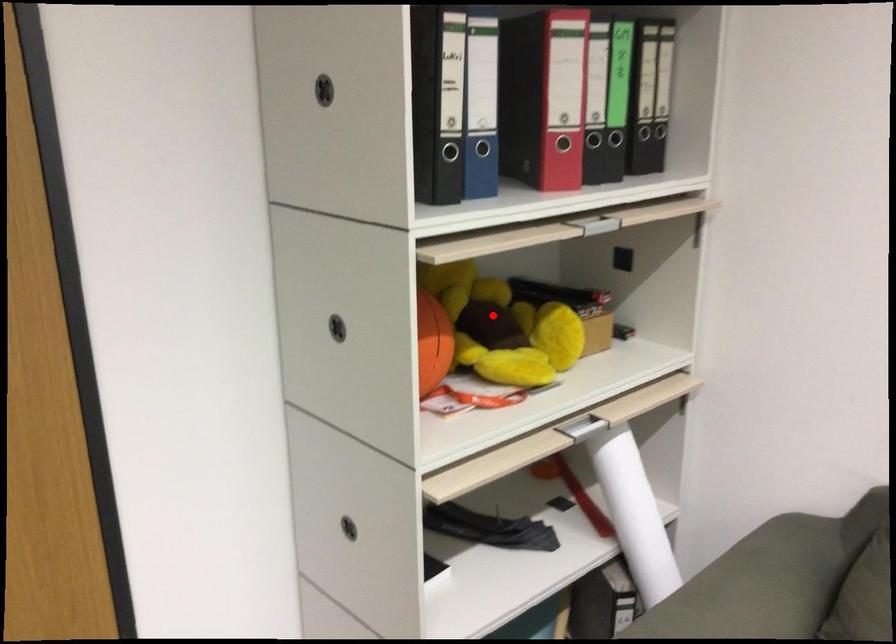
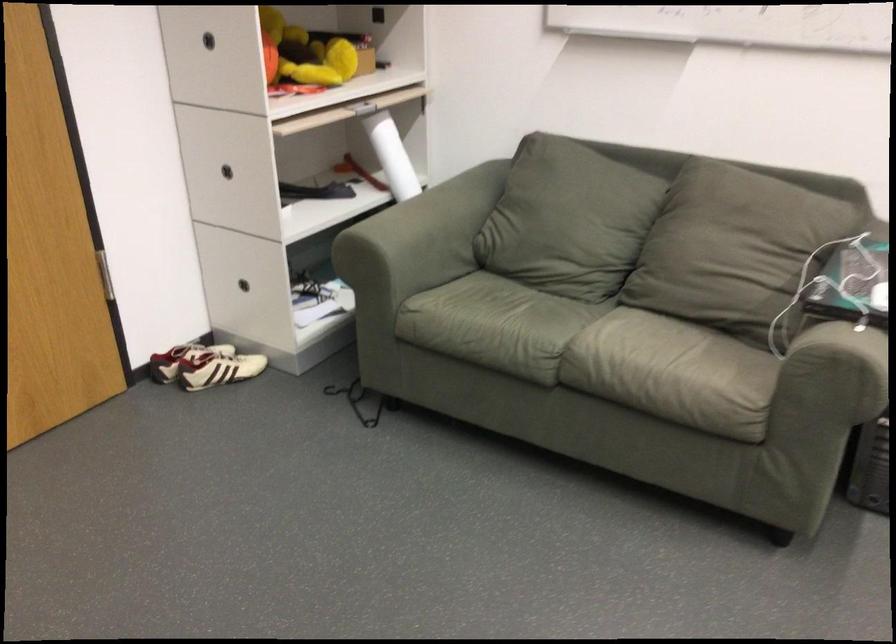
The point at the highlighted location is marked in the first image. Where is the corresponding point in the second image?

(303, 53)